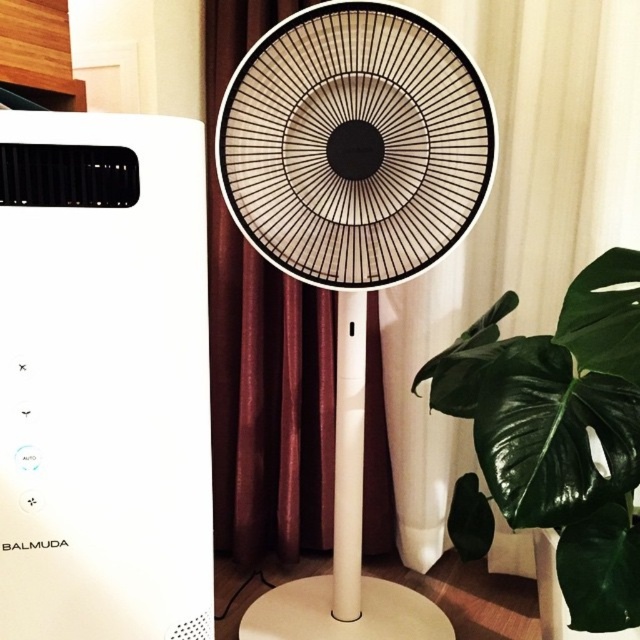
Question: Which object is closer to the camera taking this photo?

Choices:
 (A) green matte leaf at lower right
 (B) black matte fan at center

Answer: (A)

Question: Can you confirm if black matte fan at center is positioned above green matte leaf at lower right?

Choices:
 (A) no
 (B) yes

Answer: (B)

Question: Is black matte fan at center closer to camera compared to green matte leaf at lower right?

Choices:
 (A) no
 (B) yes

Answer: (A)

Question: Which object is closer to the camera taking this photo?

Choices:
 (A) black matte fan at center
 (B) green matte leaf at lower right

Answer: (B)

Question: Which point is farther from the camera taking this photo?

Choices:
 (A) (340, 170)
 (B) (632, 332)

Answer: (A)

Question: In this image, where is black matte fan at center located relative to green matte leaf at lower right?

Choices:
 (A) above
 (B) below

Answer: (A)